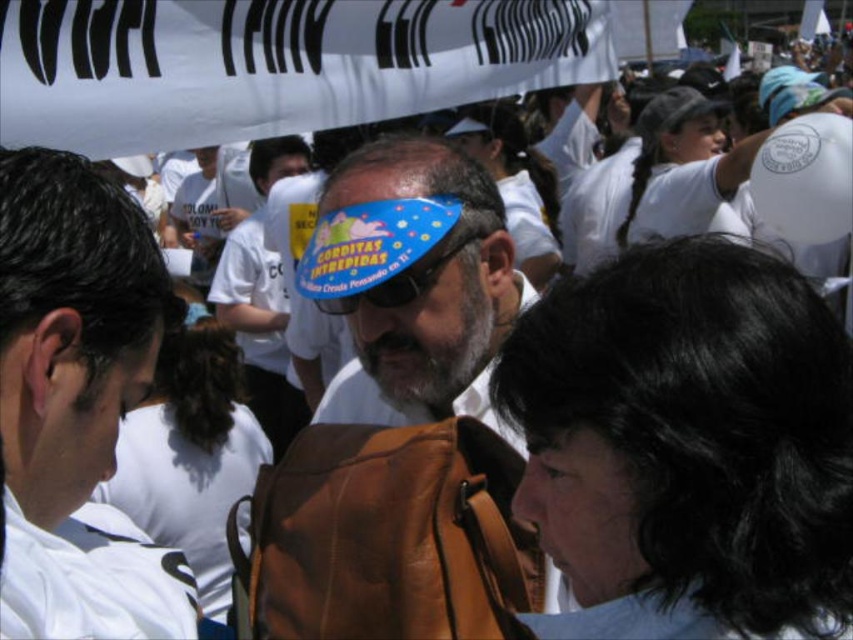
Question: Which of these objects is positioned closest to the white t-shirt at center?

Choices:
 (A) white leather shirt at center
 (B) blue plastic goggles at center

Answer: (B)

Question: In this image, where is white leather shirt at center located relative to blue plastic goggles at center?

Choices:
 (A) left
 (B) right

Answer: (A)

Question: Which of the following is the closest to the observer?

Choices:
 (A) white t-shirt at center
 (B) white leather shirt at center
 (C) blue plastic goggles at center

Answer: (B)

Question: Which object is positioned closest to the white leather shirt at center?

Choices:
 (A) white t-shirt at center
 (B) blue plastic goggles at center

Answer: (B)

Question: Can you confirm if white t-shirt at center is bigger than blue plastic goggles at center?

Choices:
 (A) yes
 (B) no

Answer: (A)

Question: Can you confirm if blue paper mask at center is positioned to the left of blue plastic goggles at center?

Choices:
 (A) yes
 (B) no

Answer: (B)